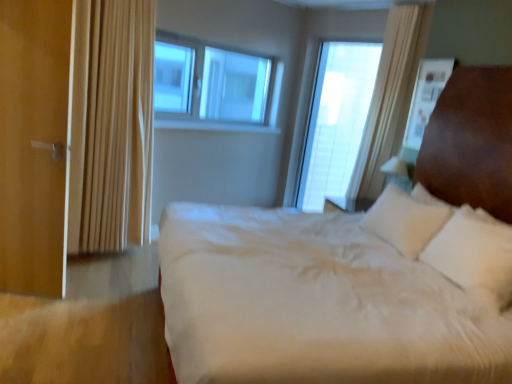
Question: Is matte wood door at left far from transparent glass window at center, placed as the first window when sorted from right to left?

Choices:
 (A) yes
 (B) no

Answer: (A)

Question: Is matte wood door at left bigger than transparent glass window at center, which ranks as the 2th window in left-to-right order?

Choices:
 (A) yes
 (B) no

Answer: (B)

Question: Considering the relative sizes of matte wood door at left and transparent glass window at center, placed as the first window when sorted from right to left, in the image provided, is matte wood door at left taller than transparent glass window at center, placed as the first window when sorted from right to left,?

Choices:
 (A) yes
 (B) no

Answer: (B)

Question: Is matte wood door at left positioned before transparent glass window at center, which ranks as the 2th window in left-to-right order?

Choices:
 (A) no
 (B) yes

Answer: (B)

Question: Can you confirm if matte wood door at left is smaller than transparent glass window at center, placed as the first window when sorted from right to left?

Choices:
 (A) yes
 (B) no

Answer: (A)

Question: Can you confirm if matte wood door at left is positioned to the left of transparent glass window at center, which ranks as the 2th window in left-to-right order?

Choices:
 (A) yes
 (B) no

Answer: (A)

Question: From a real-world perspective, is matte wood door at left on beige fabric curtain at left?

Choices:
 (A) yes
 (B) no

Answer: (B)

Question: Is matte wood door at left looking in the opposite direction of beige fabric curtain at left?

Choices:
 (A) yes
 (B) no

Answer: (A)

Question: Considering the relative sizes of matte wood door at left and beige fabric curtain at left in the image provided, is matte wood door at left bigger than beige fabric curtain at left?

Choices:
 (A) yes
 (B) no

Answer: (B)

Question: Is matte wood door at left far from beige fabric curtain at left?

Choices:
 (A) yes
 (B) no

Answer: (B)

Question: Is beige fabric curtain at left surrounded by matte wood door at left?

Choices:
 (A) yes
 (B) no

Answer: (B)

Question: Is matte wood door at left to the right of beige fabric curtain at left from the viewer's perspective?

Choices:
 (A) yes
 (B) no

Answer: (B)

Question: From the image's perspective, is transparent glass window at center, which ranks as the first window in left-to-right order, on matte wood door at left?

Choices:
 (A) no
 (B) yes

Answer: (B)